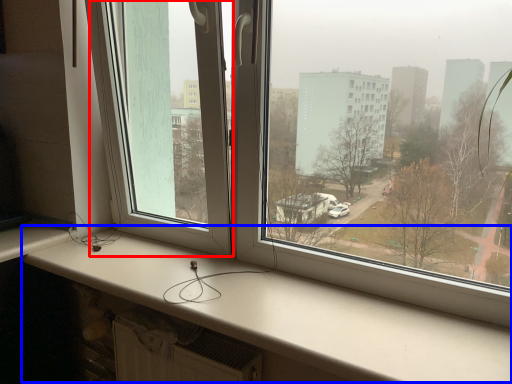
Question: Which object is closer to the camera taking this photo, window screen (highlighted by a red box) or window sill (highlighted by a blue box)?

Choices:
 (A) window screen
 (B) window sill

Answer: (B)